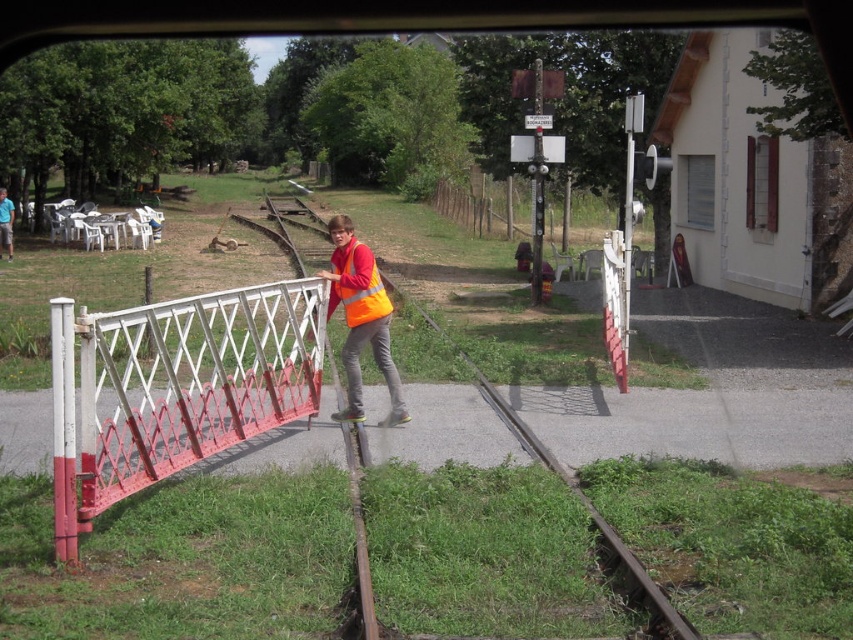
Looking at this image, you are a pedestrian trying to cross the railway tracks. You see the orange reflective vest at center and the matte orange vest at center. Which vest should you avoid stepping on to ensure safety?

The orange reflective vest at center is bigger than the matte orange vest at center, so you should avoid stepping on the orange reflective vest at center as it is larger and might be part of safety equipment.

You are a passenger in the car and you see the wooden fence at center and the matte orange vest at center through the window. Which object is closer to the left side of the railway tracks?

The matte orange vest at center is closer to the left side of the railway tracks because the wooden fence at center is positioned on the right side of it.

You are driving a car and need to park near the wooden fence at center and the matte orange vest at center. Which object is wider so you can estimate parking space better?

The wooden fence at center is wider than the matte orange vest at center, so you can estimate parking space based on its width.